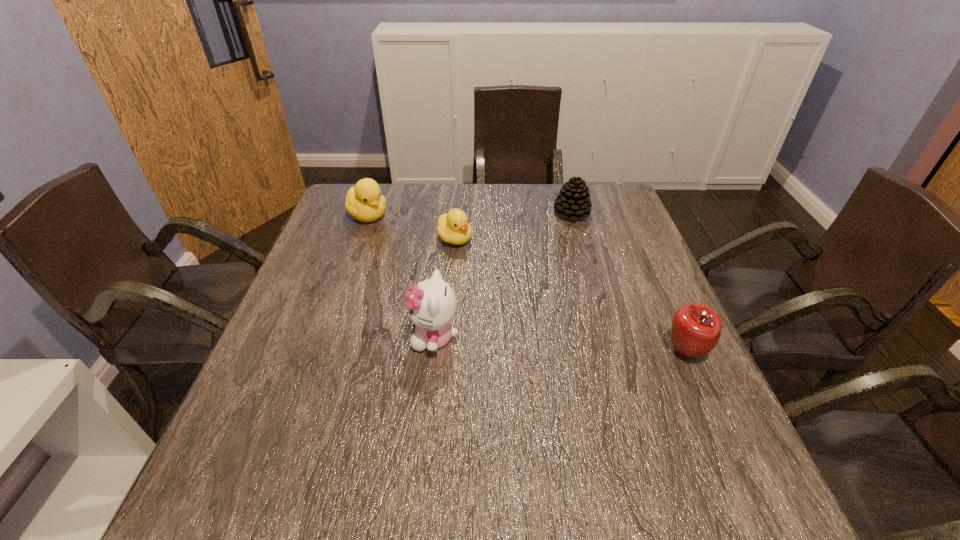
Identify the location of vacant space positioned on the front-facing side of the leftmost object. (452, 279).

Where is `vacant area located on the front-facing side of the leftmost object`? The width and height of the screenshot is (960, 540). vacant area located on the front-facing side of the leftmost object is located at coordinates (413, 249).

The height and width of the screenshot is (540, 960). Identify the location of vacant region located 0.190m on the front-facing side of the leftmost object. (417, 253).

The width and height of the screenshot is (960, 540). What are the coordinates of `vacant space located at the narrow end of the second object from right to left` in the screenshot? It's located at (579, 257).

You are a GUI agent. You are given a task and a screenshot of the screen. Output one action in this format:
    pyautogui.click(x=<x>, y=<y>)
    Task: Click on the vacant region located 0.350m at the narrow end of the second object from right to left
    Image resolution: width=960 pixels, height=540 pixels.
    Given the screenshot: What is the action you would take?
    pyautogui.click(x=588, y=306)

Locate an element on the screen. vacant space situated 0.360m at the narrow end of the second object from right to left is located at coordinates (x=588, y=309).

What are the coordinates of `vacant space located on the beak of the duckling` in the screenshot? It's located at click(500, 279).

This screenshot has height=540, width=960. I want to click on vacant space located on the beak of the duckling, so click(500, 279).

At what (x,y) coordinates should I click in order to perform the action: click on free space located on the beak of the duckling. Please return your answer as a coordinate pair (x, y). The image size is (960, 540). Looking at the image, I should click on (505, 283).

Find the location of a particular element. duck that is at the far edge is located at coordinates (364, 202).